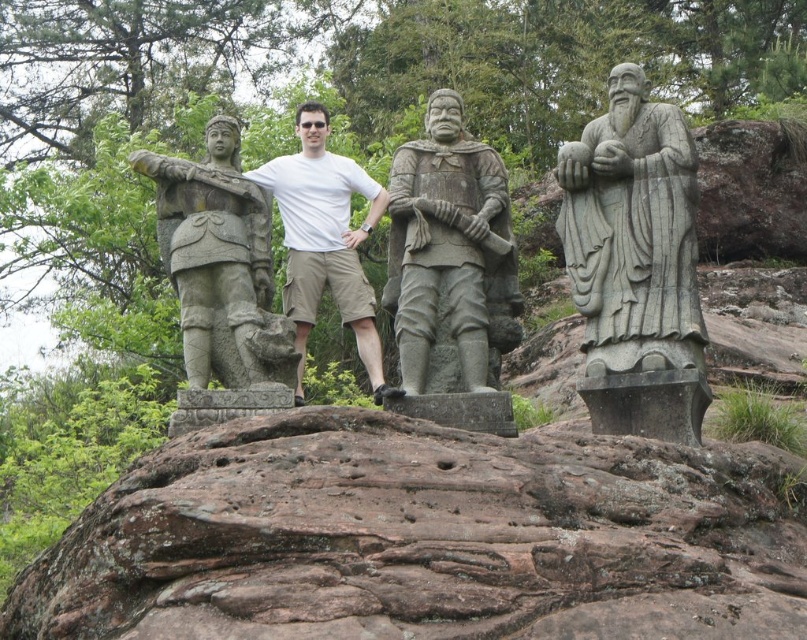
The width and height of the screenshot is (807, 640). I want to click on brown stone rock at center, so click(x=424, y=538).

The image size is (807, 640). Find the location of `brown stone rock at center`. brown stone rock at center is located at coordinates (424, 538).

Is gray stone statue at center positioned at the back of stone warrior at left?

No.

What do you see at coordinates (449, 250) in the screenshot? I see `gray stone statue at center` at bounding box center [449, 250].

At what (x,y) coordinates should I click in order to perform the action: click on gray stone statue at center. Please return your answer as a coordinate pair (x, y). Looking at the image, I should click on (449, 250).

Does white matte shirt at center appear over gray stone hand at center?

No, white matte shirt at center is not above gray stone hand at center.

Can you confirm if white matte shirt at center is smaller than gray stone hand at center?

No, white matte shirt at center is not smaller than gray stone hand at center.

Is point (360, 317) positioned in front of point (481, 225)?

No, (360, 317) is behind (481, 225).

Identify the location of white matte shirt at center. Image resolution: width=807 pixels, height=640 pixels. (324, 240).